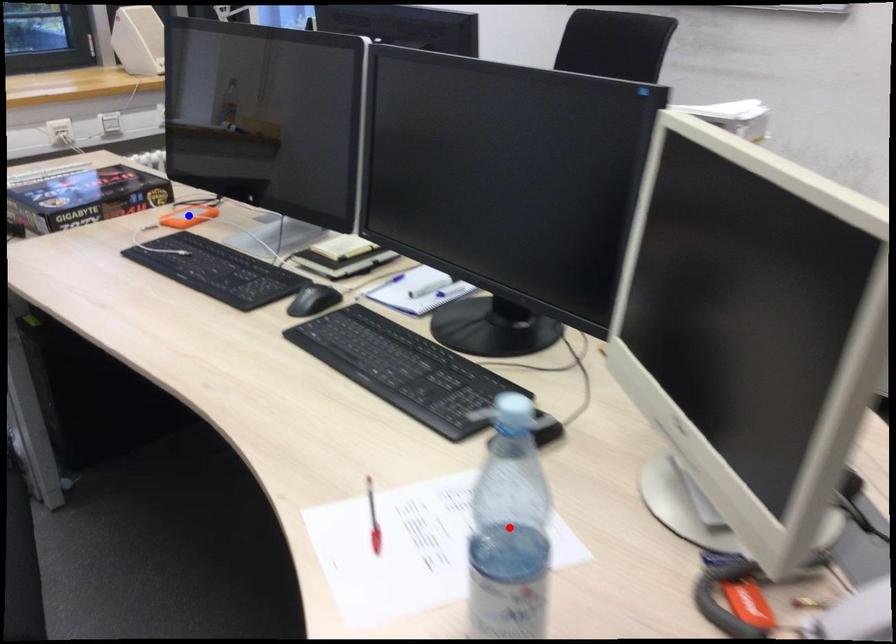
Question: Two points are marked on the image. Which point is closer to the camera?

Choices:
 (A) Blue point is closer.
 (B) Red point is closer.

Answer: (B)